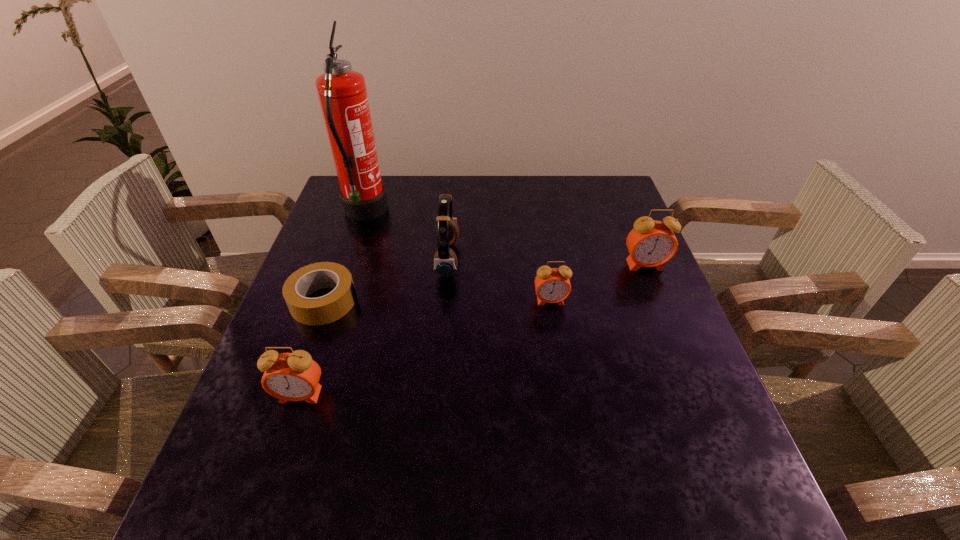
This screenshot has height=540, width=960. Identify the location of free space for an extra alarm_clock to achieve even spacing. (438, 343).